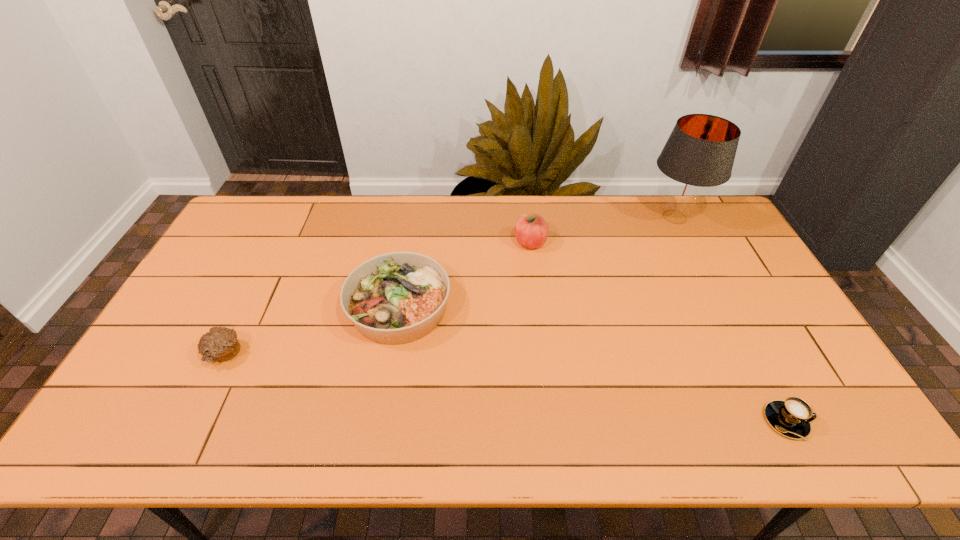
This screenshot has width=960, height=540. In order to click on free space that is in between the leftmost object and the cappuccino in this screenshot , I will do `click(505, 388)`.

Where is `unoccupied area between the leftmost object and the second object from left to right`? This screenshot has height=540, width=960. unoccupied area between the leftmost object and the second object from left to right is located at coordinates (312, 330).

The image size is (960, 540). Identify the location of vacant space that is in between the nearest object and the second object from left to right. (592, 364).

Find the location of a particular element. The height and width of the screenshot is (540, 960). free space that is in between the tallest object and the salad plate is located at coordinates (537, 262).

You are a GUI agent. You are given a task and a screenshot of the screen. Output one action in this format:
    pyautogui.click(x=<x>, y=<y>)
    Task: Click on the closest object to the nearest object
    This screenshot has height=540, width=960.
    Given the screenshot: What is the action you would take?
    tap(699, 154)

Locate which object ranks second in proximity to the third object from left to right. Please provide its 2D coordinates. Your answer should be formatted as a tuple, i.e. [(x, y)], where the tuple contains the x and y coordinates of a point satisfying the conditions above.

[(699, 154)]

Where is `free point that satisfies the following two spatial constraints: 1. on the back side of the third shortest object; 2. on the left side of the lampshade`? free point that satisfies the following two spatial constraints: 1. on the back side of the third shortest object; 2. on the left side of the lampshade is located at coordinates (415, 217).